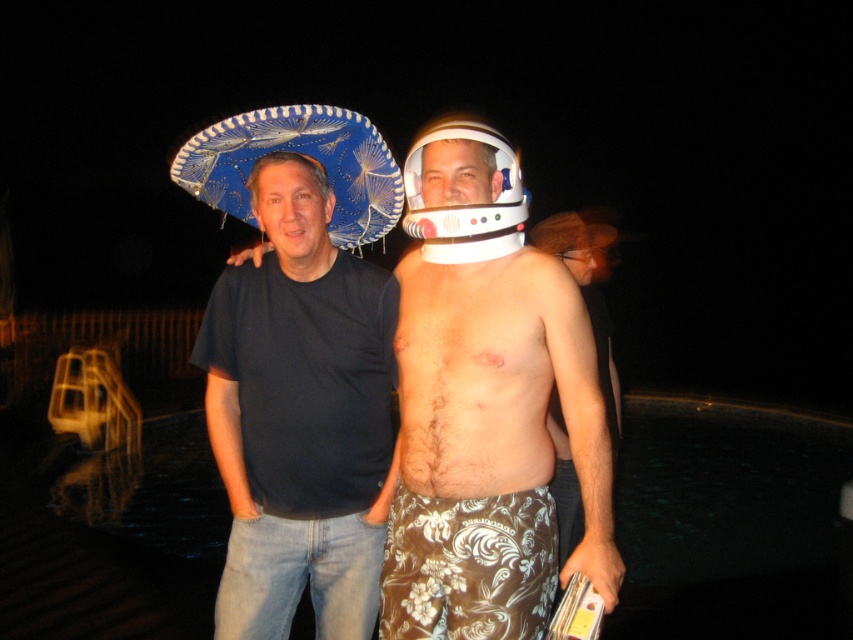
Question: Which point is closer to the camera taking this photo?

Choices:
 (A) (489, 308)
 (B) (262, 444)
 (C) (456, 161)
 (D) (267, 141)

Answer: (A)

Question: Which point appears closest to the camera in this image?

Choices:
 (A) 213,422
 (B) 494,236
 (C) 457,442

Answer: (B)

Question: Is smooth white helmet at center thinner than blue fabric sombrero at upper left?

Choices:
 (A) yes
 (B) no

Answer: (B)

Question: Considering the real-world distances, which object is closest to the blue woven sombrero at upper left?

Choices:
 (A) smooth white helmet at center
 (B) black cotton t-shirt at center
 (C) blue fabric sombrero at upper left
 (D) hairless skin at center

Answer: (B)

Question: Is hairless skin at center wider than blue fabric sombrero at upper left?

Choices:
 (A) yes
 (B) no

Answer: (A)

Question: Can you confirm if black cotton t-shirt at center is thinner than blue fabric sombrero at upper left?

Choices:
 (A) yes
 (B) no

Answer: (B)